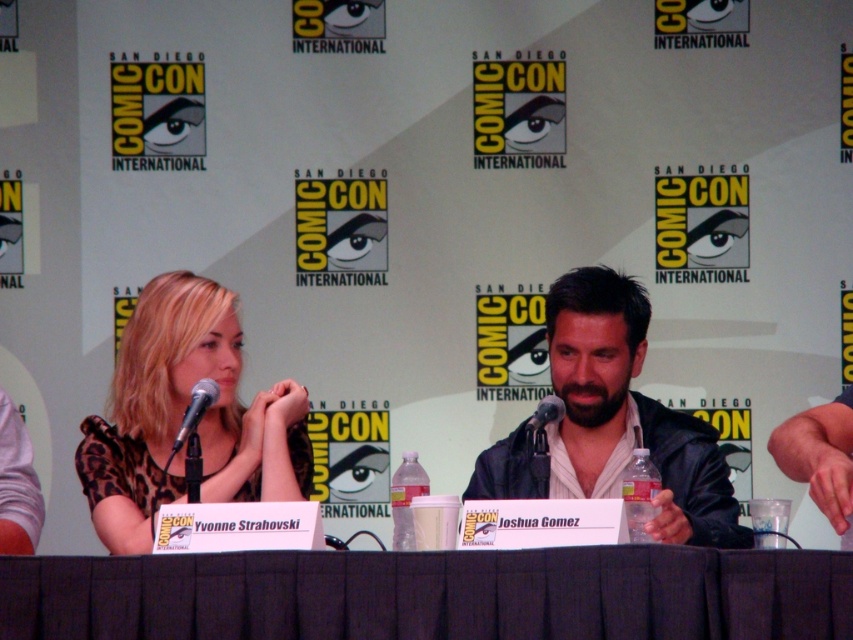
Question: Which object is closer to the camera taking this photo?

Choices:
 (A) black leather jacket at center
 (B) black plastic microphone at center
 (C) silver metallic microphone at center

Answer: (A)

Question: Based on their relative distances, which object is nearer to the black plastic microphone at center?

Choices:
 (A) black leather jacket at center
 (B) silver metallic microphone at center
 (C) black fabric table at center
 (D) leopard print dress at center

Answer: (A)

Question: Is leopard print dress at center above black plastic microphone at center?

Choices:
 (A) yes
 (B) no

Answer: (B)

Question: Is leopard print dress at center smaller than black leather jacket at center?

Choices:
 (A) yes
 (B) no

Answer: (A)

Question: Which is nearer to the leopard print dress at center?

Choices:
 (A) silver metallic microphone at center
 (B) black fabric table at center

Answer: (A)

Question: Where is silver metallic microphone at center located in relation to black plastic microphone at center in the image?

Choices:
 (A) below
 (B) above

Answer: (B)